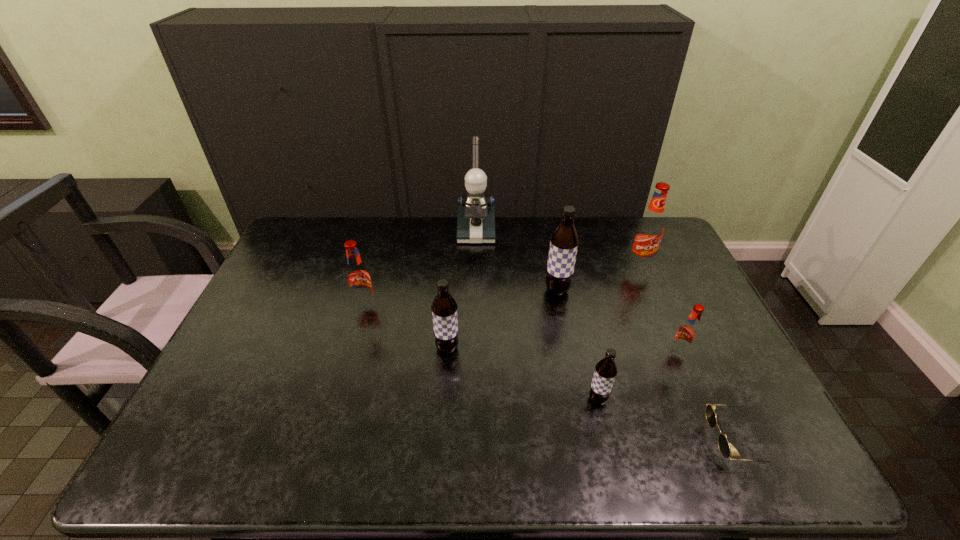
Identify the location of free spot at the left edge of the desktop. (303, 281).

You are a GUI agent. You are given a task and a screenshot of the screen. Output one action in this format:
    pyautogui.click(x=<x>, y=<y>)
    Task: Click on the free space at the right edge of the desktop
    This screenshot has width=960, height=540.
    Given the screenshot: What is the action you would take?
    pyautogui.click(x=727, y=426)

The height and width of the screenshot is (540, 960). What are the coordinates of `vacant position at the far left corner of the desktop` in the screenshot? It's located at (325, 220).

This screenshot has height=540, width=960. In order to click on vacant space that is in between the nearest red root beer and the biggest brown root beer in this screenshot , I will do `click(618, 322)`.

Image resolution: width=960 pixels, height=540 pixels. In order to click on vacant space that's between the second nearest object and the leftmost red root beer in this screenshot , I will do click(481, 353).

Find the location of a particular element. The height and width of the screenshot is (540, 960). free spot between the nearest root beer and the farthest root beer is located at coordinates (619, 332).

At what (x,y) coordinates should I click in order to perform the action: click on free space between the biggest brown root beer and the second smallest brown root beer. Please return your answer as a coordinate pair (x, y). The height and width of the screenshot is (540, 960). Looking at the image, I should click on (502, 319).

The image size is (960, 540). Find the location of `free space between the smallest red root beer and the biggest brown root beer`. free space between the smallest red root beer and the biggest brown root beer is located at coordinates click(x=618, y=322).

You are a GUI agent. You are given a task and a screenshot of the screen. Output one action in this format:
    pyautogui.click(x=<x>, y=<y>)
    Task: Click on the empty space that is in between the biggest brown root beer and the farthest object
    The image size is (960, 540).
    Given the screenshot: What is the action you would take?
    pyautogui.click(x=516, y=260)

At what (x,y) coordinates should I click in order to perform the action: click on vacant point located between the leftmost root beer and the second nearest object. Please return your answer as a coordinate pair (x, y). This screenshot has height=540, width=960. Looking at the image, I should click on (481, 353).